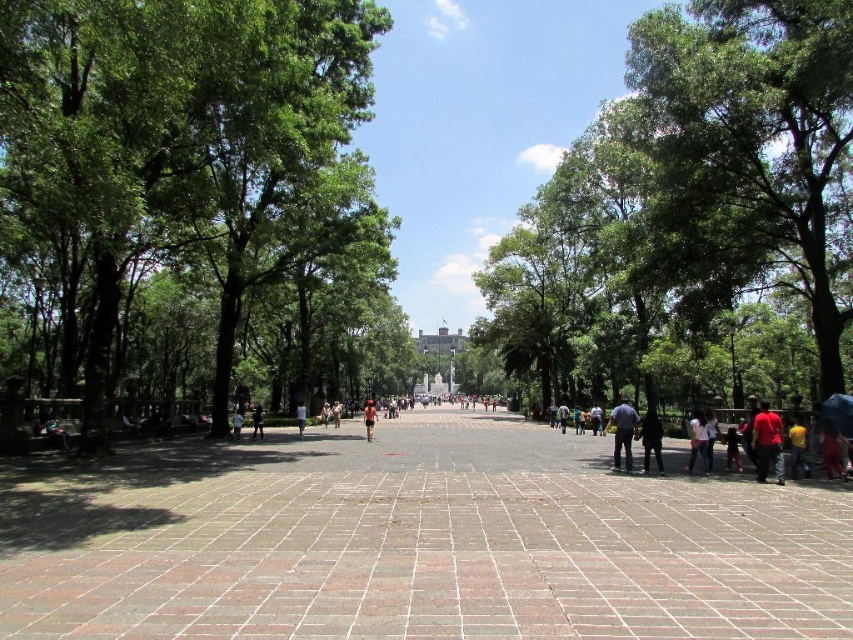
Question: Is dark blue shirt at center-right below yellow fabric umbrella at lower right?

Choices:
 (A) no
 (B) yes

Answer: (B)

Question: Where is brown brick pavement at center located in relation to red matte shirt at lower right in the image?

Choices:
 (A) above
 (B) below

Answer: (B)

Question: From the image, what is the correct spatial relationship of green leafy tree at left in relation to green leafy tree at center?

Choices:
 (A) right
 (B) left

Answer: (B)

Question: Which point appears farthest from the camera in this image?

Choices:
 (A) pyautogui.click(x=618, y=406)
 (B) pyautogui.click(x=695, y=456)
 (C) pyautogui.click(x=297, y=419)

Answer: (C)

Question: Among these objects, which one is farthest from the camera?

Choices:
 (A) dark blue jeans at center
 (B) red fabric pants at lower right

Answer: (A)

Question: Which point is closer to the camera?

Choices:
 (A) (763, 429)
 (B) (259, 426)

Answer: (A)